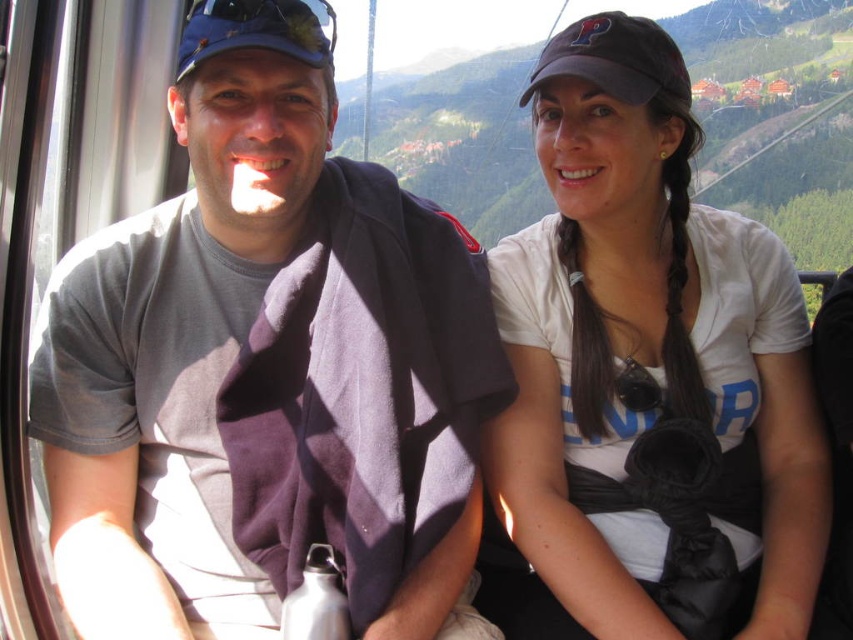
Does white matte shirt at center appear over dark gray fabric baseball cap at upper right?

No, white matte shirt at center is not above dark gray fabric baseball cap at upper right.

Who is positioned more to the left, white matte shirt at center or dark gray fabric baseball cap at upper right?

Positioned to the left is dark gray fabric baseball cap at upper right.

Identify the location of white matte shirt at center. This screenshot has width=853, height=640. pos(647,376).

Is point (355, 545) positioned after point (676, 288)?

No, it is not.

Who is positioned more to the right, gray cotton t-shirt at center or white matte shirt at center?

Positioned to the right is white matte shirt at center.

Where is `gray cotton t-shirt at center`? gray cotton t-shirt at center is located at coordinates (267, 369).

Is gray cotton t-shirt at center positioned behind dark gray fabric baseball cap at upper right?

No, it is in front of dark gray fabric baseball cap at upper right.

Is gray cotton t-shirt at center positioned in front of dark gray fabric baseball cap at upper right?

Yes, gray cotton t-shirt at center is closer to the viewer.

Between point (386, 499) and point (587, 22), which one is positioned in front?

Point (386, 499) is more forward.

This screenshot has width=853, height=640. I want to click on gray cotton t-shirt at center, so click(267, 369).